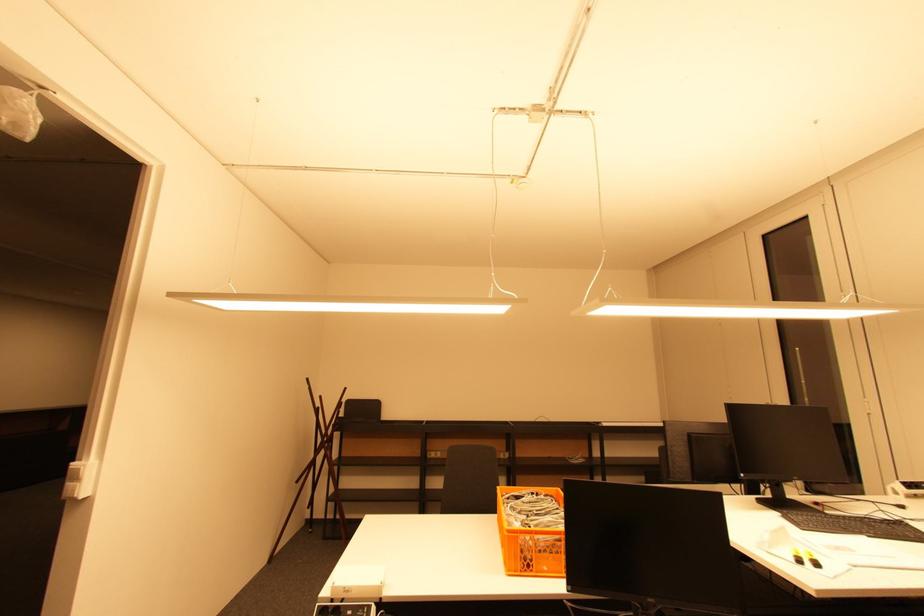
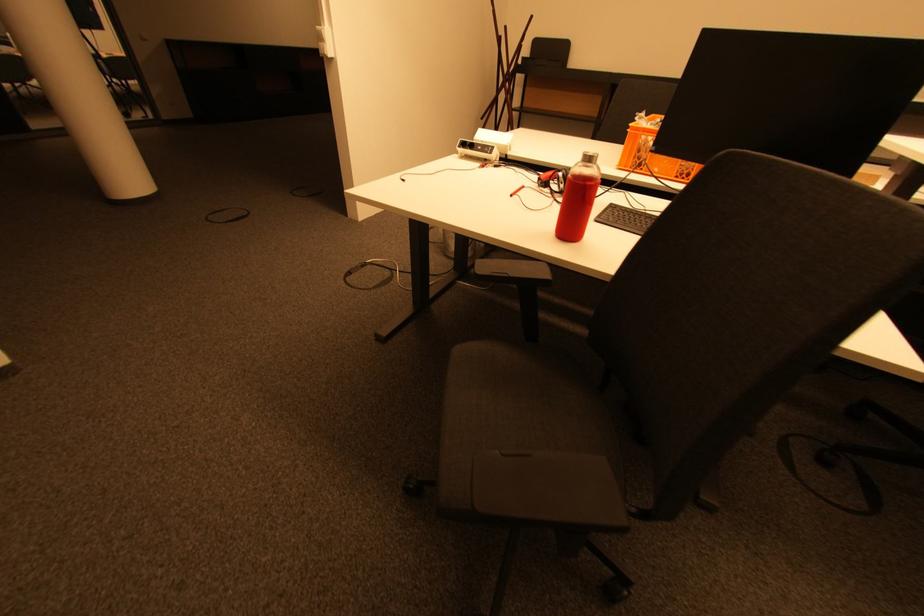
First-person continuous shooting, in which direction is the camera rotating?

The camera's rotation is toward left-down.